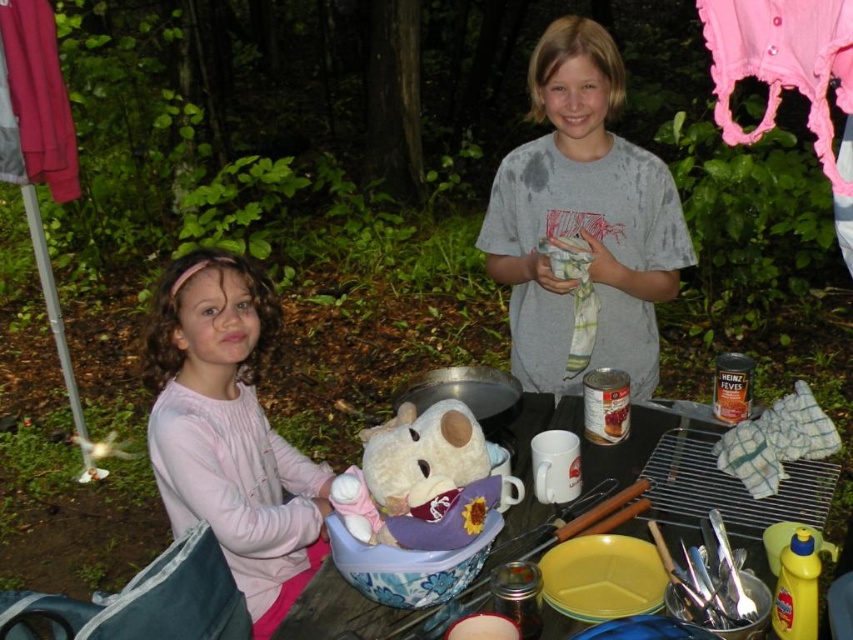
You are a photographer trying to capture a clear shot of both the gray cotton shirt at center and the pink fabric at upper left. Which object should you focus on first to ensure both are in focus?

You should focus on the gray cotton shirt at center first since it is closer to the viewer than the pink fabric at upper left. By focusing on the closer object, the farther one may still be in the depth of field, increasing the chance both are in focus.

You are a photographer trying to capture both the pink cotton shirt at left and the fluffy white teddy bear at center in a single shot. Which object should you focus on first if you want to ensure both are in focus?

You should focus on the pink cotton shirt at left first because it is larger than the fluffy white teddy bear at center, so it requires more precise focus to capture details.

Looking at this image, you are a photographer standing in front of the two children. The gray cotton shirt at center and the pink cotton shirt at left are in your view. Which child should you focus on if you want to capture the one closer to the right side of the frame?

The gray cotton shirt at center is to the right of the pink cotton shirt at left, so focusing on the gray cotton shirt at center will capture the child closer to the right side of the frame.